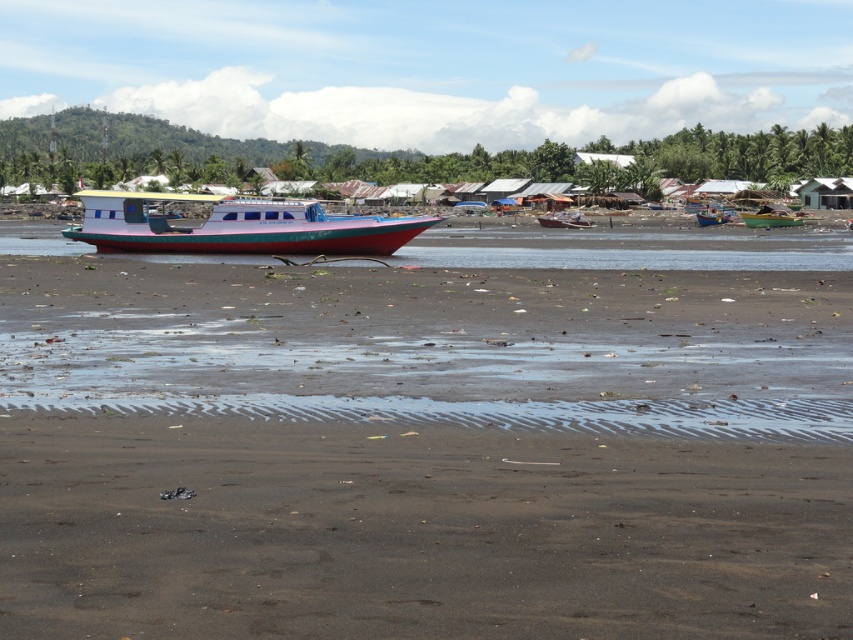
Is point (569, 518) closer to viewer compared to point (775, 212)?

Yes, it is in front of point (775, 212).

Can you confirm if dark sand at lower center is taller than green plastic boat at right?

No.

Is point (642, 509) farther from viewer compared to point (762, 208)?

No, (642, 509) is in front of (762, 208).

Where is `dark sand at lower center`? dark sand at lower center is located at coordinates (415, 532).

Is green plastic boat at right in front of blue plastic boat at center?

That is True.

Does green plastic boat at right lie behind blue plastic boat at center?

No, green plastic boat at right is closer to the viewer.

Which is in front, point (764, 218) or point (708, 218)?

Positioned in front is point (764, 218).

Where is `green plastic boat at right`? The height and width of the screenshot is (640, 853). green plastic boat at right is located at coordinates (770, 216).

Which is in front, point (676, 540) or point (579, 227)?

Point (676, 540) is in front.

Who is more distant from viewer, (376, 556) or (567, 224)?

The point (567, 224) is behind.

Image resolution: width=853 pixels, height=640 pixels. Identify the location of dark sand at lower center. [x=415, y=532].